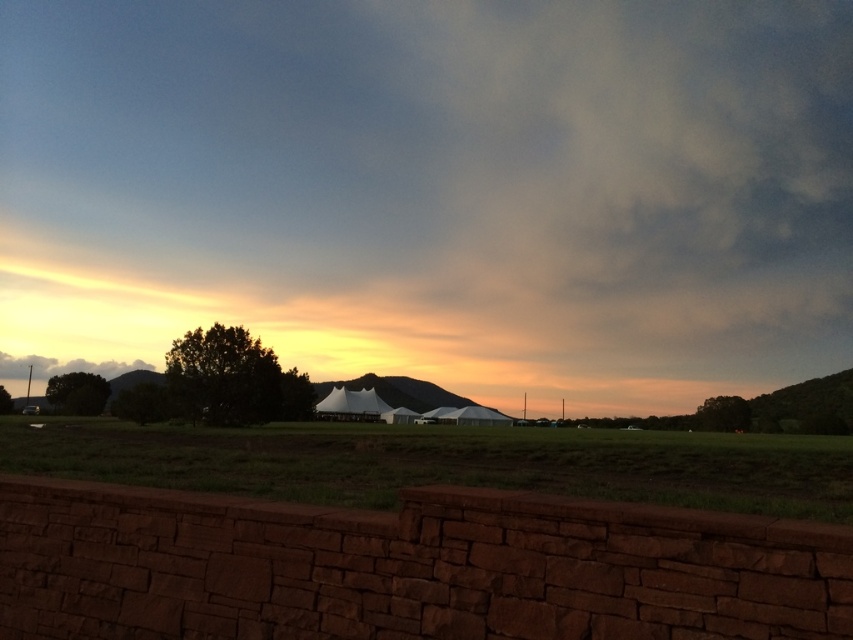
In the scene shown: Which of these two, white fabric tent at center or green grass at center, stands shorter?

green grass at center is shorter.

Can you confirm if white fabric tent at center is shorter than green grass at center?

No.

Is point (527, 74) farther from camera compared to point (181, 476)?

Yes, it is behind point (181, 476).

Image resolution: width=853 pixels, height=640 pixels. What are the coordinates of `white fabric tent at center` in the screenshot? It's located at (434, 189).